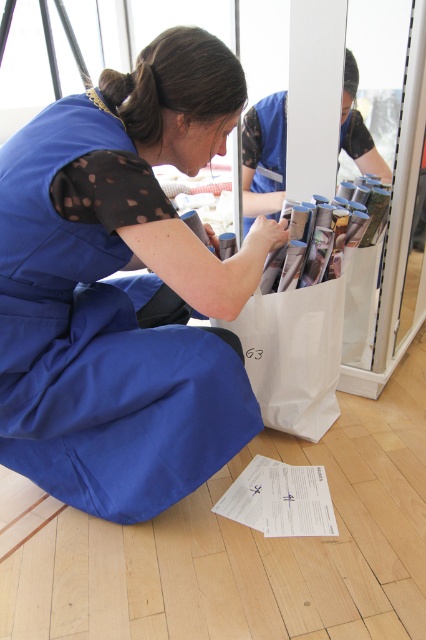
Question: Which of the following is the closest to the observer?

Choices:
 (A) white paper at lower center
 (B) white paper bag at lower center
 (C) blue fabric dress at center

Answer: (C)

Question: Among these objects, which one is farthest from the camera?

Choices:
 (A) blue fabric dress at center
 (B) white paper at lower center
 (C) white paper bag at lower center

Answer: (C)

Question: Can you confirm if blue fabric dress at center is positioned to the left of white paper bag at lower center?

Choices:
 (A) yes
 (B) no

Answer: (A)

Question: Can you confirm if blue fabric dress at center is bigger than white paper at lower center?

Choices:
 (A) yes
 (B) no

Answer: (A)

Question: Which of the following is the closest to the observer?

Choices:
 (A) blue fabric dress at center
 (B) white paper bag at lower center

Answer: (A)

Question: Does white paper bag at lower center appear on the right side of white paper at lower center?

Choices:
 (A) no
 (B) yes

Answer: (B)